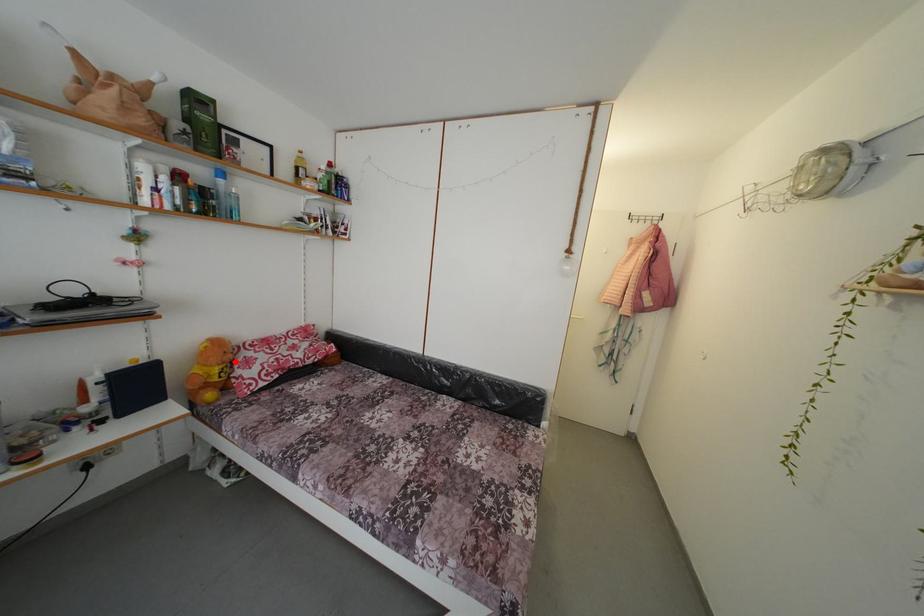
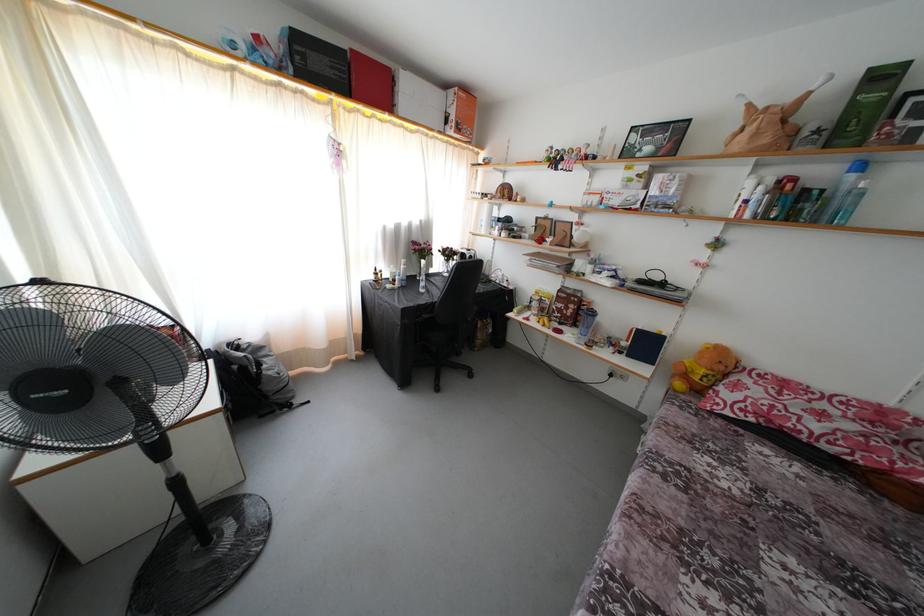
In the second image, find the point that corresponds to the highlighted location in the first image.

(726, 373)